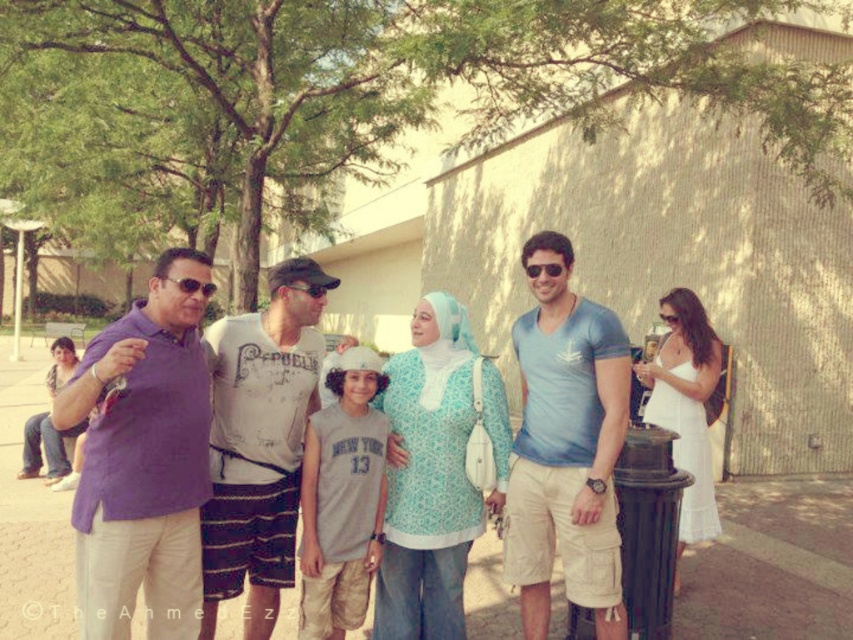
Does blue cotton t-shirt at center appear on the right side of purple cotton shirt at center?

Correct, you'll find blue cotton t-shirt at center to the right of purple cotton shirt at center.

Is blue cotton t-shirt at center further to camera compared to purple cotton shirt at center?

No, it is not.

The height and width of the screenshot is (640, 853). What are the coordinates of `blue cotton t-shirt at center` in the screenshot? It's located at (566, 448).

Can you confirm if distressed white t-shirt at center is shorter than purple cotton shirt at center?

Correct, distressed white t-shirt at center is not as tall as purple cotton shirt at center.

The height and width of the screenshot is (640, 853). Find the location of `distressed white t-shirt at center`. distressed white t-shirt at center is located at coordinates (259, 445).

Between matte black sunglasses at left and sunglasses at center, which one is positioned lower?

matte black sunglasses at left

Is matte black sunglasses at left taller than sunglasses at center?

Incorrect, matte black sunglasses at left's height is not larger of sunglasses at center's.

Where is `matte black sunglasses at left`? matte black sunglasses at left is located at coordinates (190, 284).